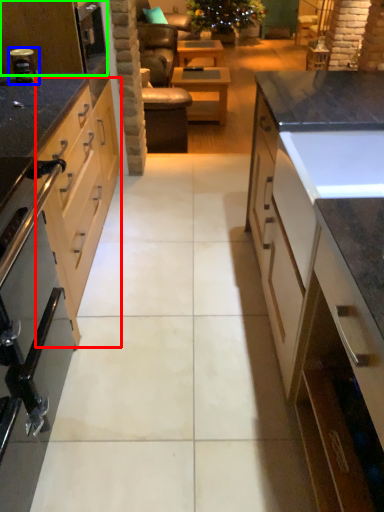
Question: Considering the real-world distances, which object is farthest from cabinetry (highlighted by a red box)? appliance (highlighted by a blue box) or kitchen appliance (highlighted by a green box)?

Choices:
 (A) appliance
 (B) kitchen appliance

Answer: (A)